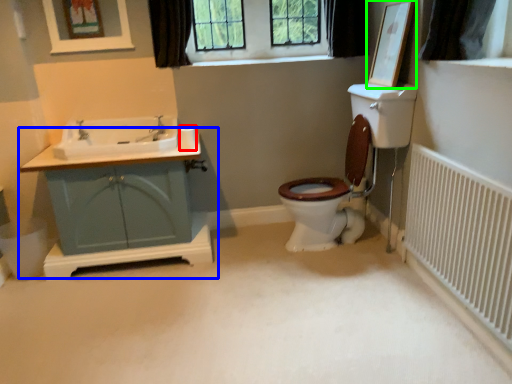
Question: Estimate the real-world distances between objects in this image. Which object is closer to toilet paper (highlighted by a red box), bathroom cabinet (highlighted by a blue box) or picture frame (highlighted by a green box)?

Choices:
 (A) bathroom cabinet
 (B) picture frame

Answer: (A)